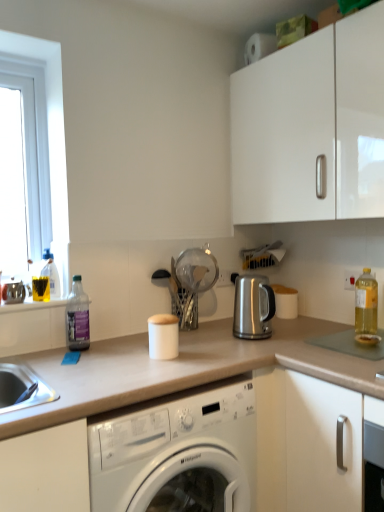
The height and width of the screenshot is (512, 384). I want to click on free space to the left of satin silver kettle at center, the third appliance in the left-to-right sequence, so click(x=222, y=338).